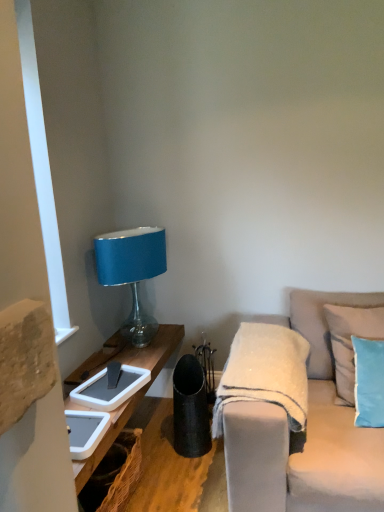
Describe the element at coordinates (307, 433) in the screenshot. I see `light beige fabric couch at right` at that location.

At what (x,y) coordinates should I click in order to perform the action: click on light beige fabric couch at right. Please return your answer as a coordinate pair (x, y). This screenshot has height=512, width=384. Looking at the image, I should click on (307, 433).

This screenshot has width=384, height=512. What do you see at coordinates (350, 340) in the screenshot? I see `light blue fabric pillow at right, marked as the first pillow in a back-to-front arrangement` at bounding box center [350, 340].

Looking at this image, in order to face matte blue fabric lampshade at upper left, should I rotate leftwards or rightwards?

Rotate left and turn 7.206 degrees.

This screenshot has width=384, height=512. Describe the element at coordinates (368, 382) in the screenshot. I see `light blue fabric pillow at right, positioned as the 2th pillow in back-to-front order` at that location.

Find the location of a particular element. The height and width of the screenshot is (512, 384). light beige fabric couch at right is located at coordinates (307, 433).

Would you consider light blue fabric pillow at right, acting as the second pillow starting from the front, to be distant from matte blue fabric lampshade at upper left?

Yes, light blue fabric pillow at right, acting as the second pillow starting from the front, and matte blue fabric lampshade at upper left are located far from each other.

Looking at this image, from a real-world perspective, is light blue fabric pillow at right, marked as the first pillow in a back-to-front arrangement, on matte blue fabric lampshade at upper left?

Incorrect, from a real-world perspective, light blue fabric pillow at right, marked as the first pillow in a back-to-front arrangement, is lower than matte blue fabric lampshade at upper left.

Measure the distance from light blue fabric pillow at right, acting as the second pillow starting from the front, to matte blue fabric lampshade at upper left.

light blue fabric pillow at right, acting as the second pillow starting from the front, is 1.14 meters from matte blue fabric lampshade at upper left.

Between light blue fabric pillow at right, acting as the second pillow starting from the front, and matte blue fabric lampshade at upper left, which one has smaller size?

light blue fabric pillow at right, acting as the second pillow starting from the front, is smaller.

Considering the sizes of objects white fuzzy blanket at center and light blue fabric pillow at right, the first pillow when ordered from front to back, in the image provided, who is taller, white fuzzy blanket at center or light blue fabric pillow at right, the first pillow when ordered from front to back,?

light blue fabric pillow at right, the first pillow when ordered from front to back.

Is there a large distance between white fuzzy blanket at center and light blue fabric pillow at right, the first pillow when ordered from front to back?

That's not correct — white fuzzy blanket at center is a little close to light blue fabric pillow at right, the first pillow when ordered from front to back.

How different are the orientations of white fuzzy blanket at center and light blue fabric pillow at right, positioned as the 2th pillow in back-to-front order, in degrees?

6.26 degrees separate the facing orientations of white fuzzy blanket at center and light blue fabric pillow at right, positioned as the 2th pillow in back-to-front order.

Which pillow is the 2nd one when counting from the right side of the white fuzzy blanket at center? Please provide its 2D coordinates.

[(350, 340)]

Considering the relative sizes of white fuzzy blanket at center and light blue fabric pillow at right, marked as the first pillow in a back-to-front arrangement, in the image provided, is white fuzzy blanket at center smaller than light blue fabric pillow at right, marked as the first pillow in a back-to-front arrangement,?

No, white fuzzy blanket at center is not smaller than light blue fabric pillow at right, marked as the first pillow in a back-to-front arrangement.

From the picture: Is white fuzzy blanket at center positioned before light blue fabric pillow at right, marked as the first pillow in a back-to-front arrangement?

Yes.

Looking at this image, from a real-world perspective, is white fuzzy blanket at center above or below light blue fabric pillow at right, acting as the second pillow starting from the front?

Clearly, from a real-world perspective, white fuzzy blanket at center is below light blue fabric pillow at right, acting as the second pillow starting from the front.

Who is smaller, matte blue fabric lampshade at upper left or light beige fabric couch at right?

matte blue fabric lampshade at upper left.

Is point (142, 266) in front of point (281, 320)?

Yes, it is.

This screenshot has width=384, height=512. What are the coordinates of `lamp located behind the light beige fabric couch at right` in the screenshot? It's located at (132, 272).

Considering the relative positions of matte blue fabric lampshade at upper left and light beige fabric couch at right in the image provided, is matte blue fabric lampshade at upper left in front of light beige fabric couch at right?

No, matte blue fabric lampshade at upper left is further to the viewer.

Can you tell me how much light blue fabric pillow at right, acting as the second pillow starting from the front, and light beige fabric couch at right differ in facing direction?

The angle between the facing direction of light blue fabric pillow at right, acting as the second pillow starting from the front, and the facing direction of light beige fabric couch at right is 2.06 degrees.

Is light blue fabric pillow at right, acting as the second pillow starting from the front, far from light beige fabric couch at right?

No, light blue fabric pillow at right, acting as the second pillow starting from the front, is not far away from light beige fabric couch at right.

From a real-world perspective, relative to light beige fabric couch at right, is light blue fabric pillow at right, marked as the first pillow in a back-to-front arrangement, vertically above or below?

From a real-world perspective, light blue fabric pillow at right, marked as the first pillow in a back-to-front arrangement, is physically above light beige fabric couch at right.

Consider the image. Is light blue fabric pillow at right, marked as the first pillow in a back-to-front arrangement, inside or outside of light beige fabric couch at right?

light blue fabric pillow at right, marked as the first pillow in a back-to-front arrangement, is spatially positioned inside light beige fabric couch at right.

From a real-world perspective, which is physically above, white fuzzy blanket at center or matte blue fabric lampshade at upper left?

In real-world perspective, matte blue fabric lampshade at upper left is above.

Considering the relative sizes of white fuzzy blanket at center and matte blue fabric lampshade at upper left in the image provided, is white fuzzy blanket at center bigger than matte blue fabric lampshade at upper left?

Actually, white fuzzy blanket at center might be smaller than matte blue fabric lampshade at upper left.

Find the location of a particular element. The width and height of the screenshot is (384, 512). blanket below the matte blue fabric lampshade at upper left (from a real-world perspective) is located at coordinates (265, 373).

Is light beige fabric couch at right shorter than matte blue fabric lampshade at upper left?

No.

Is light beige fabric couch at right far away from matte blue fabric lampshade at upper left?

Yes, light beige fabric couch at right and matte blue fabric lampshade at upper left are quite far apart.

Does light beige fabric couch at right have a lesser width compared to matte blue fabric lampshade at upper left?

In fact, light beige fabric couch at right might be wider than matte blue fabric lampshade at upper left.

Which point is more distant from viewer, (327,386) or (139,242)?

The point (139,242) is more distant.

Identify the location of the 1st pillow below the matte blue fabric lampshade at upper left (from the image's perspective). (350, 340).

What are the coordinates of `blanket in front of the light blue fabric pillow at right, the first pillow when ordered from front to back` in the screenshot? It's located at (265, 373).

Based on their spatial positions, is white fuzzy blanket at center or matte blue fabric lampshade at upper left closer to light beige fabric couch at right?

white fuzzy blanket at center.

Based on their spatial positions, is light beige fabric couch at right or matte blue fabric lampshade at upper left closer to light blue fabric pillow at right, marked as the first pillow in a back-to-front arrangement?

light beige fabric couch at right.

Considering their positions, is white fuzzy blanket at center positioned further to matte blue fabric lampshade at upper left than light blue fabric pillow at right, marked as the first pillow in a back-to-front arrangement?

The object further to matte blue fabric lampshade at upper left is light blue fabric pillow at right, marked as the first pillow in a back-to-front arrangement.

Which object lies nearer to the anchor point light blue fabric pillow at right, positioned as the 2th pillow in back-to-front order, light beige fabric couch at right or matte blue fabric lampshade at upper left?

Among the two, light beige fabric couch at right is located nearer to light blue fabric pillow at right, positioned as the 2th pillow in back-to-front order.

In the scene shown: From the image, which object appears to be farther from matte blue fabric lampshade at upper left, light beige fabric couch at right or white fuzzy blanket at center?

The object further to matte blue fabric lampshade at upper left is light beige fabric couch at right.

Based on the photo, estimate the real-world distances between objects in this image. Which object is closer to matte blue fabric lampshade at upper left, white fuzzy blanket at center or light blue fabric pillow at right, positioned as the 2th pillow in back-to-front order?

white fuzzy blanket at center is closer to matte blue fabric lampshade at upper left.

Which object lies further to the anchor point light beige fabric couch at right, light blue fabric pillow at right, marked as the first pillow in a back-to-front arrangement, or matte blue fabric lampshade at upper left?

matte blue fabric lampshade at upper left is further to light beige fabric couch at right.

Considering their positions, is white fuzzy blanket at center positioned closer to light blue fabric pillow at right, acting as the second pillow starting from the front, than light beige fabric couch at right?

Based on the image, light beige fabric couch at right appears to be nearer to light blue fabric pillow at right, acting as the second pillow starting from the front.

Locate an element on the screen. studio couch between white fuzzy blanket at center and light blue fabric pillow at right, positioned as the 2th pillow in back-to-front order, in the horizontal direction is located at coordinates (307, 433).

This screenshot has height=512, width=384. I want to click on blanket situated between matte blue fabric lampshade at upper left and light blue fabric pillow at right, positioned as the 2th pillow in back-to-front order, from left to right, so click(265, 373).

Find the location of `pillow positioned between light beige fabric couch at right and light blue fabric pillow at right, marked as the first pillow in a back-to-front arrangement, from near to far`. pillow positioned between light beige fabric couch at right and light blue fabric pillow at right, marked as the first pillow in a back-to-front arrangement, from near to far is located at coordinates (368, 382).

Locate an element on the screen. This screenshot has height=512, width=384. studio couch situated between matte blue fabric lampshade at upper left and light blue fabric pillow at right, positioned as the 2th pillow in back-to-front order, from left to right is located at coordinates (307, 433).